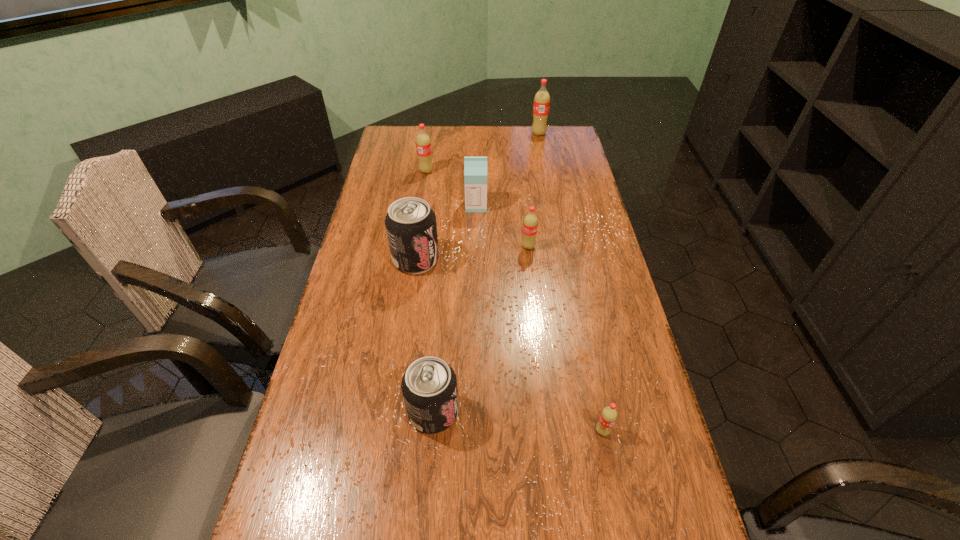
Locate an element on the screen. This screenshot has width=960, height=540. the smallest red soda is located at coordinates 609,415.

The width and height of the screenshot is (960, 540). Find the location of `the shortest soda`. the shortest soda is located at coordinates (609, 415).

Image resolution: width=960 pixels, height=540 pixels. Identify the location of vacant space positioned 0.330m on the left of the farthest object. (455, 134).

Locate an element on the screen. This screenshot has width=960, height=540. vacant region located on the right of the second farthest red soda is located at coordinates (465, 171).

The height and width of the screenshot is (540, 960). What are the coordinates of `vacant position located 0.080m on the back of the farther black soda can` in the screenshot? It's located at (420, 228).

Locate an element on the screen. The height and width of the screenshot is (540, 960). vacant area located 0.330m on the back of the fifth nearest object is located at coordinates (476, 152).

Locate an element on the screen. The height and width of the screenshot is (540, 960). vacant area located on the front of the nearer black soda can is located at coordinates (424, 532).

Where is `free location located on the left of the third biggest red soda`? Image resolution: width=960 pixels, height=540 pixels. free location located on the left of the third biggest red soda is located at coordinates (462, 247).

Image resolution: width=960 pixels, height=540 pixels. What are the coordinates of `vacant space situated on the back of the nearest red soda` in the screenshot? It's located at (594, 388).

You are a GUI agent. You are given a task and a screenshot of the screen. Output one action in this format:
    pyautogui.click(x=<x>, y=<y>)
    Task: Click on the object that is at the far edge
    
    Given the screenshot: What is the action you would take?
    pyautogui.click(x=541, y=105)